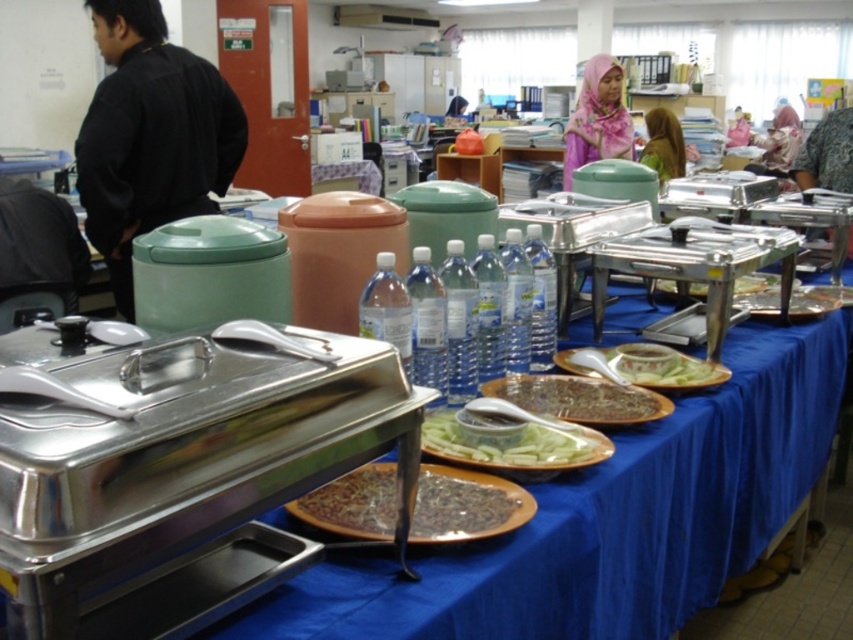
Image resolution: width=853 pixels, height=640 pixels. What do you see at coordinates (664, 365) in the screenshot? I see `white glossy bowl at center` at bounding box center [664, 365].

Does point (646, 353) come behind point (730, 140)?

No, (646, 353) is closer to viewer.

Does point (637, 358) come behind point (735, 144)?

That is False.

The image size is (853, 640). Find the location of `white glossy bowl at center`. white glossy bowl at center is located at coordinates (664, 365).

Who is lower down, brown matte rice at center or green matte bowl at center?

brown matte rice at center

The height and width of the screenshot is (640, 853). Find the location of `brown matte rice at center`. brown matte rice at center is located at coordinates (465, 506).

Can you confirm if green matte bowl at center is smaller than pink fabric headscarf at upper center?

Yes.

Is point (587, 408) farther from viewer compared to point (746, 116)?

No, it is in front of (746, 116).

Where is `green matte bowl at center`? This screenshot has height=640, width=853. green matte bowl at center is located at coordinates (577, 397).